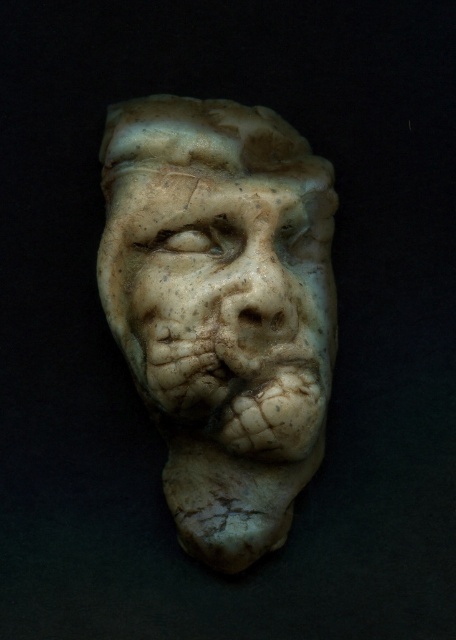
Question: Can you confirm if white marble sculpture at center is wider than marble sculpture of face at center?

Choices:
 (A) yes
 (B) no

Answer: (A)

Question: Considering the relative positions of white marble sculpture at center and marble sculpture of face at center in the image provided, where is white marble sculpture at center located with respect to marble sculpture of face at center?

Choices:
 (A) left
 (B) right

Answer: (A)

Question: Which point appears farthest from the camera in this image?

Choices:
 (A) (260, 369)
 (B) (221, 147)

Answer: (B)

Question: Which point appears closest to the camera in this image?

Choices:
 (A) (253, 177)
 (B) (156, 369)

Answer: (B)

Question: Does white marble sculpture at center have a greater width compared to marble sculpture of face at center?

Choices:
 (A) yes
 (B) no

Answer: (A)